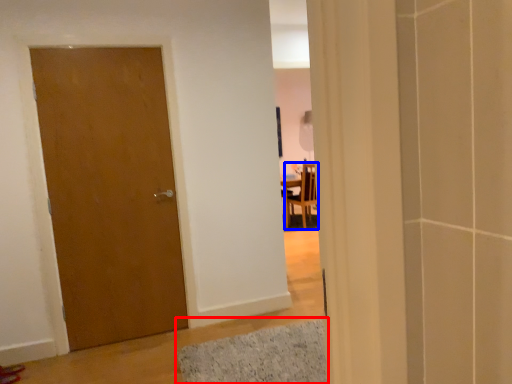
Question: Which object appears closest to the camera in this image, bath mat (highlighted by a red box) or chair (highlighted by a blue box)?

Choices:
 (A) bath mat
 (B) chair

Answer: (A)